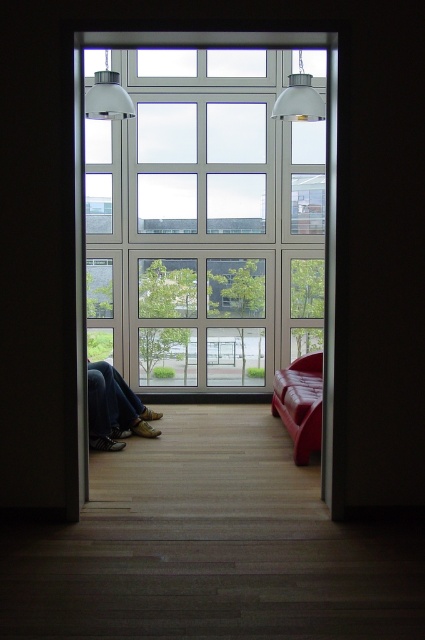
Is clear glass window at center wider than leather couch at right?

Correct, the width of clear glass window at center exceeds that of leather couch at right.

Does point (218, 272) lie behind point (274, 413)?

Yes, point (218, 272) is behind point (274, 413).

The image size is (425, 640). What are the coordinates of `clear glass window at center` in the screenshot? It's located at (204, 221).

Find the location of `leather shoes at lower left`. leather shoes at lower left is located at coordinates (115, 410).

What are the coordinates of `leather shoes at lower left` in the screenshot? It's located at (115, 410).

Between clear glass window at center and leather shoes at lower left, which one appears on the left side from the viewer's perspective?

leather shoes at lower left

Is clear glass window at center thinner than leather shoes at lower left?

No, clear glass window at center is not thinner than leather shoes at lower left.

Is point (99, 273) closer to viewer compared to point (149, 412)?

No, (99, 273) is behind (149, 412).

Locate an element on the screen. clear glass window at center is located at coordinates (204, 221).